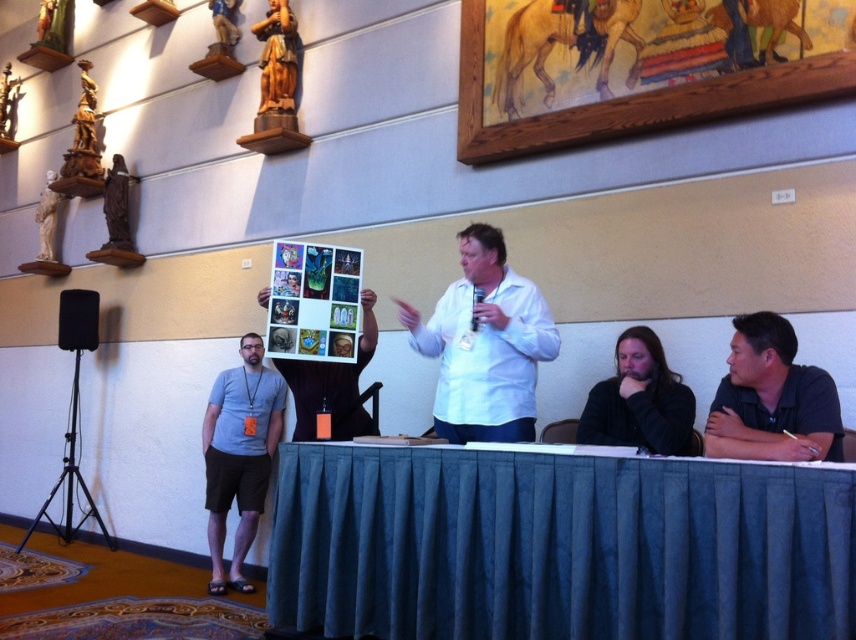
You are organizing a photo shoot in the conference room. You need to decide which object, the black matte shirt at lower right or the wooden statue at upper left, will require a larger camera frame to capture in full detail. Which one should you focus on first?

The black matte shirt at lower right is bigger than the wooden statue at upper left, so you should focus on capturing the black matte shirt at lower right first as it requires a larger camera frame to ensure all details are visible.